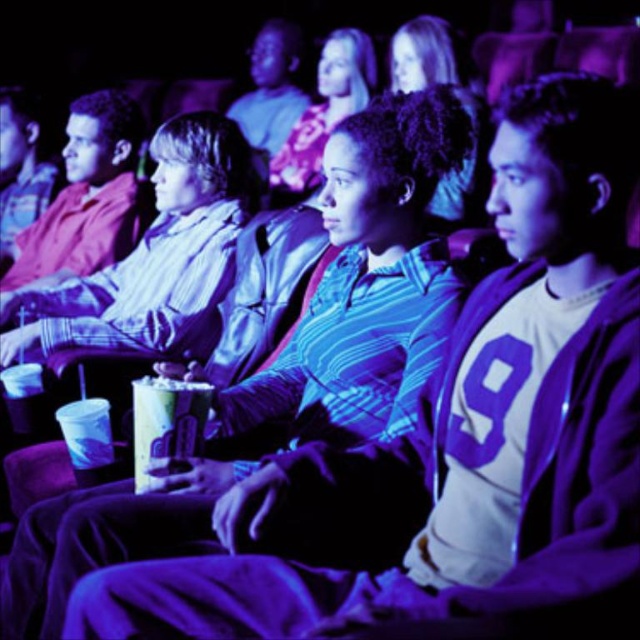
Who is shorter, striped cotton shirt at center or matte blue shirt at center?

matte blue shirt at center is shorter.

Consider the image. Does striped cotton shirt at center appear under matte blue shirt at center?

Yes, striped cotton shirt at center is below matte blue shirt at center.

This screenshot has width=640, height=640. What do you see at coordinates (368, 284) in the screenshot?
I see `striped cotton shirt at center` at bounding box center [368, 284].

Find the location of a particular element. The width and height of the screenshot is (640, 640). striped cotton shirt at center is located at coordinates (368, 284).

Is matte blue shirt at center above translucent plastic cup at center?

Indeed, matte blue shirt at center is positioned over translucent plastic cup at center.

Is matte blue shirt at center wider than translucent plastic cup at center?

Indeed, matte blue shirt at center has a greater width compared to translucent plastic cup at center.

Who is more distant from viewer, (365, 99) or (186, 451)?

The point (365, 99) is more distant.

At what (x,y) coordinates should I click in order to perform the action: click on matte blue shirt at center. Please return your answer as a coordinate pair (x, y). The width and height of the screenshot is (640, 640). Looking at the image, I should click on (324, 109).

Which is behind, point (104, 554) or point (141, 420)?

Point (141, 420)

Consider the image. Can you confirm if striped cotton shirt at center is shorter than translucent plastic cup at center?

In fact, striped cotton shirt at center may be taller than translucent plastic cup at center.

Find the location of a particular element. striped cotton shirt at center is located at coordinates (368, 284).